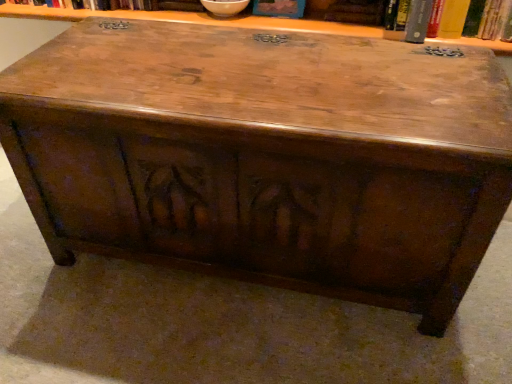
Describe the element at coordinates (279, 8) in the screenshot. I see `blue cardboard book at upper center, which is the 2th book in right-to-left order` at that location.

This screenshot has width=512, height=384. I want to click on blue cardboard book at upper center, which is the 2th book in right-to-left order, so click(279, 8).

Where is `hardcover book at upper right, arranged as the second book when viewed from the left`? hardcover book at upper right, arranged as the second book when viewed from the left is located at coordinates (496, 21).

Describe the element at coordinates (496, 21) in the screenshot. I see `hardcover book at upper right, the first book viewed from the right` at that location.

This screenshot has height=384, width=512. Identify the location of blue cardboard book at upper center, which is the 2th book in right-to-left order. (279, 8).

Is blue cardboard book at upper center, which is the 2th book in right-to-left order, to the left of hardcover book at upper right, arranged as the second book when viewed from the left, from the viewer's perspective?

Indeed, blue cardboard book at upper center, which is the 2th book in right-to-left order, is positioned on the left side of hardcover book at upper right, arranged as the second book when viewed from the left.

Which object is more forward, blue cardboard book at upper center, which is the first book in left-to-right order, or hardcover book at upper right, the first book viewed from the right?

hardcover book at upper right, the first book viewed from the right, is closer to the camera.

Does point (288, 16) come closer to viewer compared to point (457, 23)?

No, (288, 16) is behind (457, 23).

From the image's perspective, between blue cardboard book at upper center, which is the first book in left-to-right order, and hardcover book at upper right, the first book viewed from the right, which one is located above?

From the image's view, blue cardboard book at upper center, which is the first book in left-to-right order, is above.

From a real-world perspective, between blue cardboard book at upper center, which is the 2th book in right-to-left order, and hardcover book at upper right, arranged as the second book when viewed from the left, who is vertically higher?

hardcover book at upper right, arranged as the second book when viewed from the left, is physically above.

Is blue cardboard book at upper center, which is the first book in left-to-right order, wider than hardcover book at upper right, the first book viewed from the right?

Incorrect, the width of blue cardboard book at upper center, which is the first book in left-to-right order, does not surpass that of hardcover book at upper right, the first book viewed from the right.

Considering the sizes of objects blue cardboard book at upper center, which is the first book in left-to-right order, and hardcover book at upper right, the first book viewed from the right, in the image provided, who is taller, blue cardboard book at upper center, which is the first book in left-to-right order, or hardcover book at upper right, the first book viewed from the right,?

hardcover book at upper right, the first book viewed from the right, is taller.

Who is smaller, blue cardboard book at upper center, which is the 2th book in right-to-left order, or hardcover book at upper right, arranged as the second book when viewed from the left?

Smaller between the two is blue cardboard book at upper center, which is the 2th book in right-to-left order.

Is blue cardboard book at upper center, which is the 2th book in right-to-left order, positioned beyond the bounds of hardcover book at upper right, arranged as the second book when viewed from the left?

Indeed, blue cardboard book at upper center, which is the 2th book in right-to-left order, is completely outside hardcover book at upper right, arranged as the second book when viewed from the left.

Is blue cardboard book at upper center, which is the first book in left-to-right order, touching hardcover book at upper right, arranged as the second book when viewed from the left?

No.

Could you tell me if blue cardboard book at upper center, which is the first book in left-to-right order, is turned towards hardcover book at upper right, the first book viewed from the right?

No, blue cardboard book at upper center, which is the first book in left-to-right order, is not aimed at hardcover book at upper right, the first book viewed from the right.

How many degrees apart are the facing directions of blue cardboard book at upper center, which is the 2th book in right-to-left order, and hardcover book at upper right, arranged as the second book when viewed from the left?

The facing directions of blue cardboard book at upper center, which is the 2th book in right-to-left order, and hardcover book at upper right, arranged as the second book when viewed from the left, are 0.00268 degrees apart.

Could you measure the distance between blue cardboard book at upper center, which is the first book in left-to-right order, and hardcover book at upper right, the first book viewed from the right?

blue cardboard book at upper center, which is the first book in left-to-right order, is 16.18 inches away from hardcover book at upper right, the first book viewed from the right.

Identify the location of book lying above the hardcover book at upper right, arranged as the second book when viewed from the left (from the image's perspective). The image size is (512, 384). (279, 8).

Is hardcover book at upper right, the first book viewed from the right, at the left side of blue cardboard book at upper center, which is the 2th book in right-to-left order?

In fact, hardcover book at upper right, the first book viewed from the right, is to the right of blue cardboard book at upper center, which is the 2th book in right-to-left order.

Which object is closer to the camera taking this photo, hardcover book at upper right, the first book viewed from the right, or blue cardboard book at upper center, which is the first book in left-to-right order?

A: hardcover book at upper right, the first book viewed from the right, is in front.

Considering the points (407, 33) and (302, 13), which point is behind, point (407, 33) or point (302, 13)?

Positioned behind is point (302, 13).

From the image's perspective, relative to blue cardboard book at upper center, which is the first book in left-to-right order, is hardcover book at upper right, arranged as the second book when viewed from the left, above or below?

hardcover book at upper right, arranged as the second book when viewed from the left, is below blue cardboard book at upper center, which is the first book in left-to-right order.

From a real-world perspective, is hardcover book at upper right, the first book viewed from the right, above or below blue cardboard book at upper center, which is the first book in left-to-right order?

hardcover book at upper right, the first book viewed from the right, is above blue cardboard book at upper center, which is the first book in left-to-right order.

Looking at this image, considering the sizes of objects hardcover book at upper right, the first book viewed from the right, and blue cardboard book at upper center, which is the 2th book in right-to-left order, in the image provided, who is thinner, hardcover book at upper right, the first book viewed from the right, or blue cardboard book at upper center, which is the 2th book in right-to-left order,?

Thinner between the two is blue cardboard book at upper center, which is the 2th book in right-to-left order.

Based on the photo, who is shorter, hardcover book at upper right, the first book viewed from the right, or blue cardboard book at upper center, which is the 2th book in right-to-left order?

blue cardboard book at upper center, which is the 2th book in right-to-left order, is shorter.

Is hardcover book at upper right, arranged as the second book when viewed from the left, bigger than blue cardboard book at upper center, which is the first book in left-to-right order?

Yes, hardcover book at upper right, arranged as the second book when viewed from the left, is bigger than blue cardboard book at upper center, which is the first book in left-to-right order.

Is blue cardboard book at upper center, which is the first book in left-to-right order, located within hardcover book at upper right, arranged as the second book when viewed from the left?

No, blue cardboard book at upper center, which is the first book in left-to-right order, is not a part of hardcover book at upper right, arranged as the second book when viewed from the left.

Looking at this image, is hardcover book at upper right, the first book viewed from the right, with blue cardboard book at upper center, which is the 2th book in right-to-left order?

No, hardcover book at upper right, the first book viewed from the right, is not in contact with blue cardboard book at upper center, which is the 2th book in right-to-left order.

Is hardcover book at upper right, the first book viewed from the right, looking in the opposite direction of blue cardboard book at upper center, which is the 2th book in right-to-left order?

No, hardcover book at upper right, the first book viewed from the right, is not facing away from blue cardboard book at upper center, which is the 2th book in right-to-left order.

How far apart are hardcover book at upper right, the first book viewed from the right, and blue cardboard book at upper center, which is the 2th book in right-to-left order?

The distance of hardcover book at upper right, the first book viewed from the right, from blue cardboard book at upper center, which is the 2th book in right-to-left order, is 41.10 centimeters.

The image size is (512, 384). In order to click on book below the blue cardboard book at upper center, which is the 2th book in right-to-left order (from the image's perspective) in this screenshot , I will do `click(496, 21)`.

This screenshot has width=512, height=384. What are the coordinates of `book in front of the blue cardboard book at upper center, which is the first book in left-to-right order` in the screenshot? It's located at (496, 21).

In the image, there is a blue cardboard book at upper center, which is the 2th book in right-to-left order. Where is `book below it (from the image's perspective)`? The height and width of the screenshot is (384, 512). book below it (from the image's perspective) is located at coordinates (496, 21).